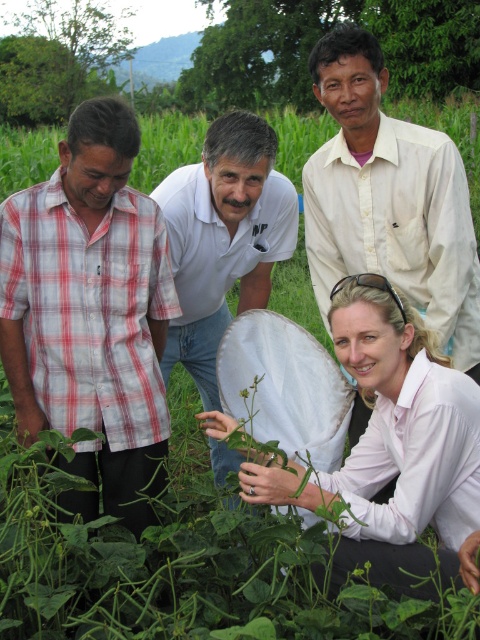
Does red plaid shirt at left appear on the left side of white smooth shirt at center?

Yes, red plaid shirt at left is to the left of white smooth shirt at center.

Is red plaid shirt at left smaller than white smooth shirt at center?

Yes.

Find the location of `red plaid shirt at left`. red plaid shirt at left is located at coordinates (91, 308).

Does red plaid shirt at left lie in front of white shirt at upper center?

Yes, red plaid shirt at left is in front of white shirt at upper center.

Can you confirm if red plaid shirt at left is shorter than white shirt at upper center?

Incorrect, red plaid shirt at left's height does not fall short of white shirt at upper center's.

Identify the location of red plaid shirt at left. (91, 308).

Is red plaid shirt at left taller than pink smooth shirt at lower center?

Indeed, red plaid shirt at left has a greater height compared to pink smooth shirt at lower center.

Is point (163, 342) behind point (467, 456)?

Yes, it is behind point (467, 456).

This screenshot has height=640, width=480. What are the coordinates of `red plaid shirt at left` in the screenshot? It's located at (91, 308).